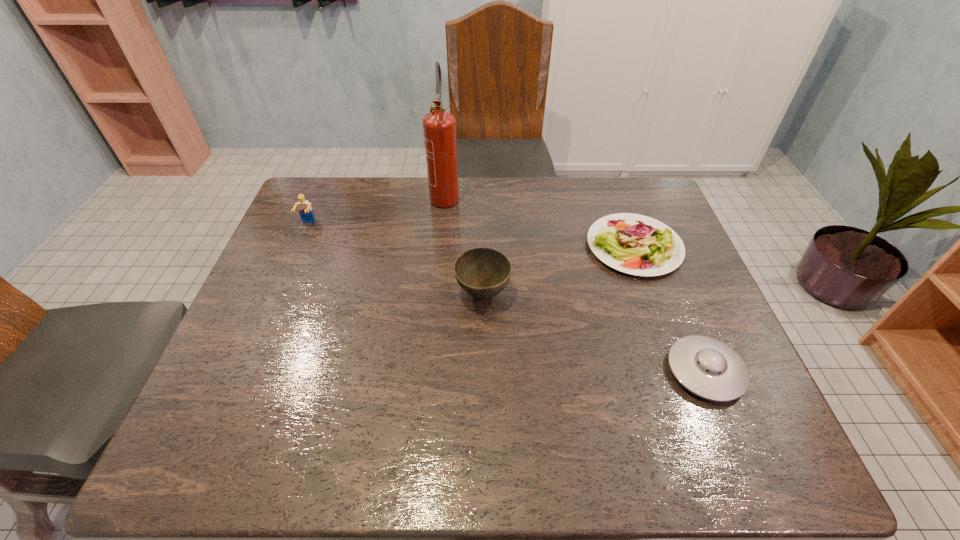
Locate an element on the screen. The height and width of the screenshot is (540, 960). free space located on the back of the nearest object is located at coordinates (682, 314).

The image size is (960, 540). Find the location of `fire extinguisher that is at the far edge`. fire extinguisher that is at the far edge is located at coordinates (439, 127).

This screenshot has width=960, height=540. Find the location of `Lego that is at the far edge`. Lego that is at the far edge is located at coordinates (305, 210).

Locate an element on the screen. Image resolution: width=960 pixels, height=540 pixels. salad plate that is positioned at the far edge is located at coordinates (635, 244).

In order to click on object located in the left edge section of the desktop in this screenshot , I will do `click(305, 210)`.

This screenshot has width=960, height=540. Identify the location of salad plate at the right edge. (635, 244).

The image size is (960, 540). I want to click on saucer situated at the right edge, so click(x=708, y=368).

Locate an element on the screen. This screenshot has width=960, height=540. object that is positioned at the far left corner is located at coordinates (305, 210).

In order to click on object located in the far right corner section of the desktop in this screenshot , I will do `click(635, 244)`.

The image size is (960, 540). Find the location of `vacant space at the far edge of the desktop`. vacant space at the far edge of the desktop is located at coordinates (576, 208).